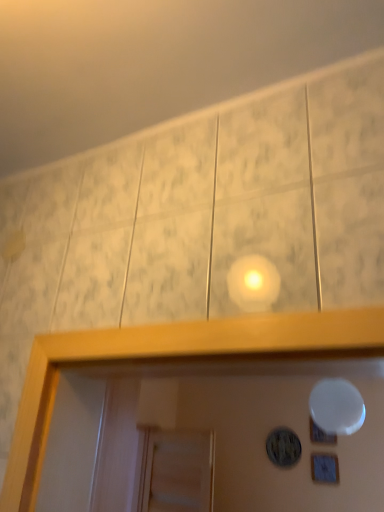
Question: Could you tell me if white glossy mirror at upper center is turned towards wooden frame at lower right?

Choices:
 (A) no
 (B) yes

Answer: (A)

Question: From the image's perspective, would you say white glossy mirror at upper center is positioned over wooden frame at lower right?

Choices:
 (A) yes
 (B) no

Answer: (A)

Question: Is the depth of white glossy mirror at upper center less than that of wooden frame at lower right?

Choices:
 (A) no
 (B) yes

Answer: (B)

Question: Considering the relative sizes of white glossy mirror at upper center and wooden frame at lower right in the image provided, is white glossy mirror at upper center wider than wooden frame at lower right?

Choices:
 (A) yes
 (B) no

Answer: (A)

Question: Is white glossy mirror at upper center positioned with its back to wooden frame at lower right?

Choices:
 (A) no
 (B) yes

Answer: (A)

Question: In terms of size, does wooden frame at lower right appear bigger or smaller than matte black circular object at center, which is the first dot in left-to-right order?

Choices:
 (A) big
 (B) small

Answer: (B)

Question: Considering the relative positions of wooden frame at lower right and matte black circular object at center, which is the first dot in left-to-right order, in the image provided, is wooden frame at lower right to the left or to the right of matte black circular object at center, which is the first dot in left-to-right order,?

Choices:
 (A) left
 (B) right

Answer: (B)

Question: Looking at their shapes, would you say wooden frame at lower right is wider or thinner than matte black circular object at center, which is the first dot in left-to-right order?

Choices:
 (A) wide
 (B) thin

Answer: (B)

Question: Does point [x=337, y=478] appear closer or farther from the camera than point [x=284, y=464]?

Choices:
 (A) closer
 (B) farther

Answer: (A)

Question: In terms of width, does wooden frame at lower right look wider or thinner when compared to white glossy mirror at upper center?

Choices:
 (A) thin
 (B) wide

Answer: (A)

Question: Is wooden frame at lower right bigger or smaller than white glossy mirror at upper center?

Choices:
 (A) big
 (B) small

Answer: (B)

Question: From their relative heights in the image, would you say wooden frame at lower right is taller or shorter than white glossy mirror at upper center?

Choices:
 (A) tall
 (B) short

Answer: (B)

Question: Relative to white glossy mirror at upper center, is wooden frame at lower right in front or behind?

Choices:
 (A) behind
 (B) front

Answer: (A)

Question: Would you say white glossy plate at upper center, marked as the 2th dot in a left-to-right arrangement, is to the left or to the right of white glossy mirror at upper center in the picture?

Choices:
 (A) left
 (B) right

Answer: (B)

Question: Is white glossy plate at upper center, marked as the 2th dot in a left-to-right arrangement, bigger or smaller than white glossy mirror at upper center?

Choices:
 (A) big
 (B) small

Answer: (B)